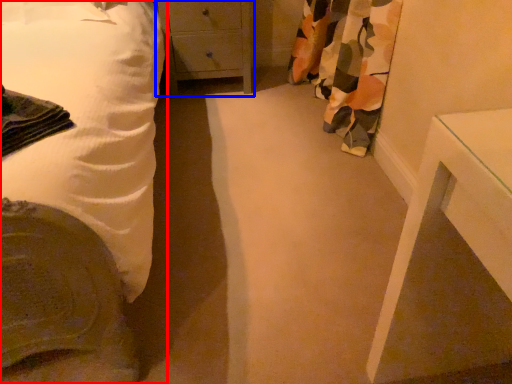
Question: Among these objects, which one is farthest to the camera, bed (highlighted by a red box) or chest of drawers (highlighted by a blue box)?

Choices:
 (A) bed
 (B) chest of drawers

Answer: (B)